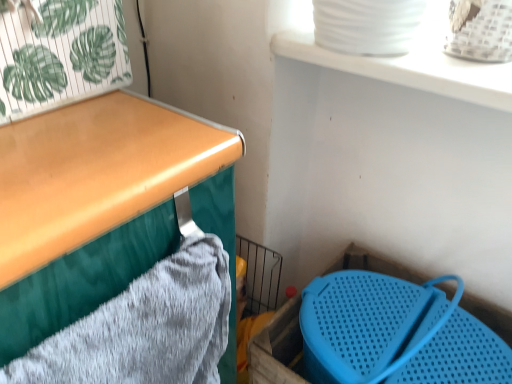
You are a GUI agent. You are given a task and a screenshot of the screen. Output one action in this format:
    pyautogui.click(x=<x>, y=<y>)
    Task: Click on the blue plastic storage box at lower right
    
    Given the screenshot: What is the action you would take?
    pyautogui.click(x=277, y=347)

The image size is (512, 384). What are the coordinates of `plant that is on the left side of gray textured bath towel at left` in the screenshot? It's located at (59, 53).

Can you confirm if gray textured bath towel at left is positioned to the right of green leafy paper at upper left?

Yes.

Would you say gray textured bath towel at left is a long distance from green leafy paper at upper left?

gray textured bath towel at left is actually quite close to green leafy paper at upper left.

Is blue plastic storage box at lower right not close to gray textured bath towel at left?

They are positioned close to each other.

From a real-world perspective, who is located lower, blue plastic storage box at lower right or gray textured bath towel at left?

blue plastic storage box at lower right.

Does blue plastic storage box at lower right lie behind gray textured bath towel at left?

That is True.

Is gray textured bath towel at left located within blue plastic storage box at lower right?

That's incorrect, gray textured bath towel at left is not inside blue plastic storage box at lower right.

Between green leafy paper at upper left and gray textured bath towel at left, which one appears on the right side from the viewer's perspective?

From the viewer's perspective, gray textured bath towel at left appears more on the right side.

Consider the image. Is the surface of green leafy paper at upper left in direct contact with gray textured bath towel at left?

green leafy paper at upper left and gray textured bath towel at left are not in contact.

Considering the sizes of green leafy paper at upper left and gray textured bath towel at left in the image, is green leafy paper at upper left bigger or smaller than gray textured bath towel at left?

Considering their sizes, green leafy paper at upper left takes up more space than gray textured bath towel at left.

Looking at this image, between green leafy paper at upper left and gray textured bath towel at left, which one has larger width?

green leafy paper at upper left is wider.

Who is more distant, green leafy paper at upper left or blue plastic storage box at lower right?

blue plastic storage box at lower right is further away from the camera.

Considering the positions of points (14, 11) and (336, 268), is point (14, 11) farther from camera compared to point (336, 268)?

No, (14, 11) is in front of (336, 268).

Could you tell me if green leafy paper at upper left is turned towards blue plastic storage box at lower right?

No, green leafy paper at upper left is not oriented towards blue plastic storage box at lower right.

From a real-world perspective, is green leafy paper at upper left beneath blue plastic storage box at lower right?

No, from a real-world perspective, green leafy paper at upper left is not beneath blue plastic storage box at lower right.

In the scene shown: Does blue plastic storage box at lower right appear on the left side of green leafy paper at upper left?

In fact, blue plastic storage box at lower right is to the right of green leafy paper at upper left.

Considering the relative sizes of blue plastic storage box at lower right and green leafy paper at upper left in the image provided, is blue plastic storage box at lower right thinner than green leafy paper at upper left?

No.

Is blue plastic storage box at lower right inside or outside of green leafy paper at upper left?

The correct answer is: outside.

Is there a large distance between blue plastic storage box at lower right and green leafy paper at upper left?

That's not correct — blue plastic storage box at lower right is a little close to green leafy paper at upper left.

Is gray textured bath towel at left not within blue plastic storage box at lower right?

Yes, gray textured bath towel at left is located beyond the bounds of blue plastic storage box at lower right.

The height and width of the screenshot is (384, 512). Find the location of `bath towel in front of the blue plastic storage box at lower right`. bath towel in front of the blue plastic storage box at lower right is located at coordinates (145, 328).

Based on the photo, which object is thinner, gray textured bath towel at left or blue plastic storage box at lower right?

gray textured bath towel at left is thinner.

Which object is further away from the camera, gray textured bath towel at left or blue plastic storage box at lower right?

blue plastic storage box at lower right.

Identify the location of bath towel located on the right of green leafy paper at upper left. (145, 328).

Where is `bath towel on the left of blue plastic storage box at lower right`? Image resolution: width=512 pixels, height=384 pixels. bath towel on the left of blue plastic storage box at lower right is located at coordinates click(x=145, y=328).

Considering their positions, is gray textured bath towel at left positioned further to blue plastic storage box at lower right than green leafy paper at upper left?

The object further to blue plastic storage box at lower right is green leafy paper at upper left.

Considering their positions, is green leafy paper at upper left positioned further to gray textured bath towel at left than blue plastic storage box at lower right?

blue plastic storage box at lower right is positioned further to the anchor gray textured bath towel at left.

Which object lies nearer to the anchor point gray textured bath towel at left, blue plastic storage box at lower right or green leafy paper at upper left?

green leafy paper at upper left.

Considering their positions, is gray textured bath towel at left positioned closer to green leafy paper at upper left than blue plastic storage box at lower right?

Among the two, gray textured bath towel at left is located nearer to green leafy paper at upper left.

Looking at the image, which one is located closer to blue plastic storage box at lower right, green leafy paper at upper left or gray textured bath towel at left?

gray textured bath towel at left is positioned closer to the anchor blue plastic storage box at lower right.

Considering their positions, is blue plastic storage box at lower right positioned closer to green leafy paper at upper left than gray textured bath towel at left?

Among the two, gray textured bath towel at left is located nearer to green leafy paper at upper left.

Locate an element on the screen. This screenshot has height=384, width=512. bath towel between green leafy paper at upper left and blue plastic storage box at lower right from left to right is located at coordinates (145, 328).